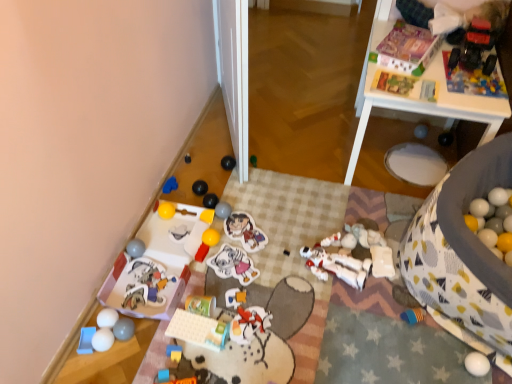
Image resolution: width=512 pixels, height=384 pixels. In order to click on vacant area that lies between white matte sticker at center, which is the nineteenth toy from left to right, and rubber ball at center, which ranks as the seventeenth toy in left-to-right order in this screenshot , I will do `click(230, 241)`.